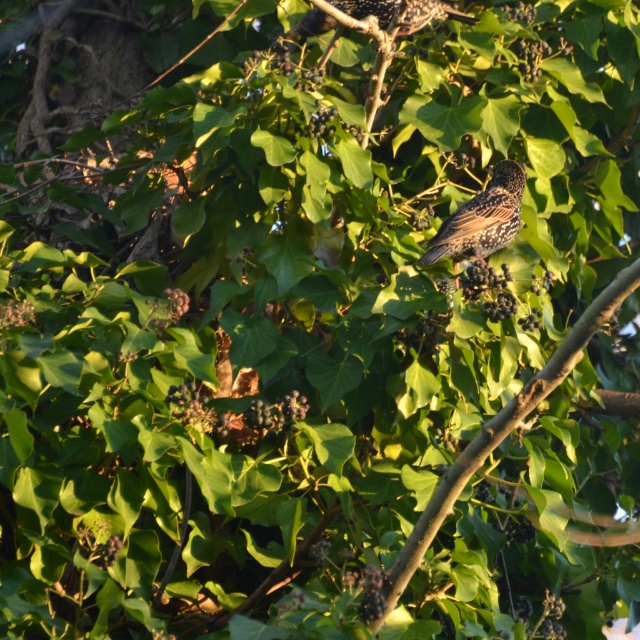
Question: Does brown wood tree branch at center have a lesser width compared to brown speckled bird at upper center?

Choices:
 (A) yes
 (B) no

Answer: (B)

Question: Is brown wood tree branch at center wider than brown speckled bird at upper center?

Choices:
 (A) yes
 (B) no

Answer: (A)

Question: Which of the following is the farthest from the observer?

Choices:
 (A) brown speckled bird at upper center
 (B) brown wood tree branch at center

Answer: (A)

Question: Which of the following is the farthest from the observer?

Choices:
 (A) (580, 316)
 (B) (500, 182)

Answer: (A)

Question: Does brown wood tree branch at center have a greater width compared to brown speckled bird at upper center?

Choices:
 (A) no
 (B) yes

Answer: (B)